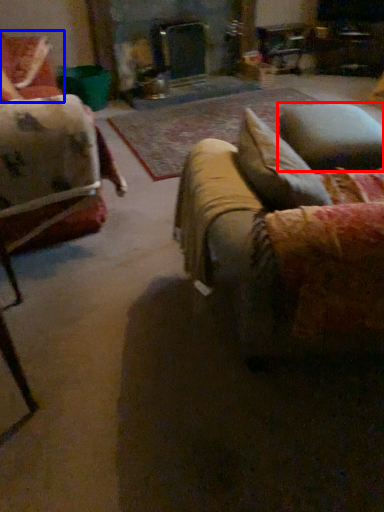
Question: Which of the following is the farthest to the observer, pillow (highlighted by a red box) or chair (highlighted by a blue box)?

Choices:
 (A) pillow
 (B) chair

Answer: (B)